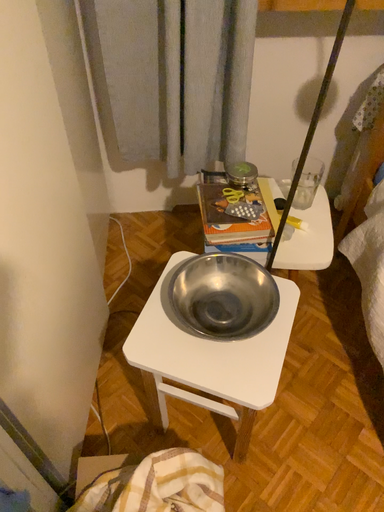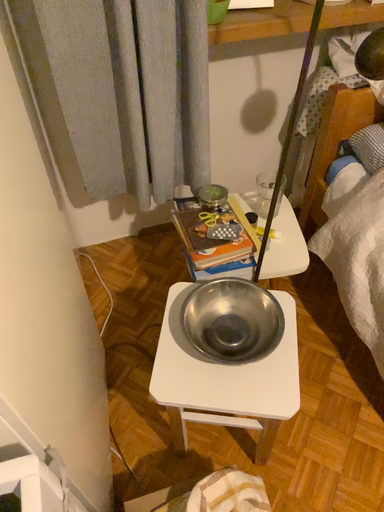
Question: Which way did the camera rotate in the video?

Choices:
 (A) rotated right
 (B) rotated left

Answer: (A)